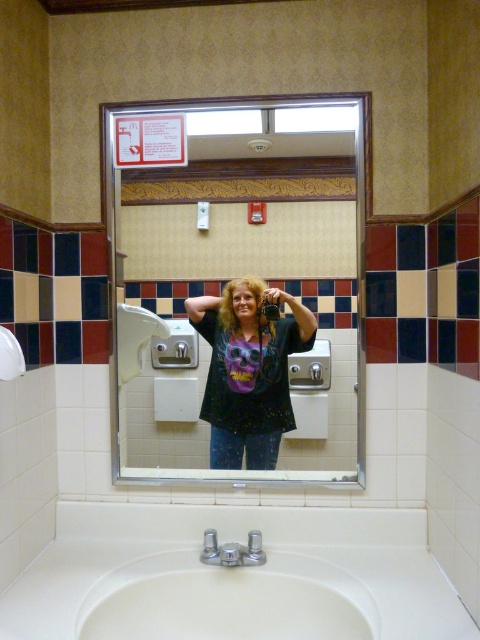
Question: Is white glossy sink at lower center to the left of matte black t-shirt at center from the viewer's perspective?

Choices:
 (A) yes
 (B) no

Answer: (A)

Question: Does clear glass mirror at upper center have a greater width compared to white glossy sink at lower center?

Choices:
 (A) no
 (B) yes

Answer: (B)

Question: Considering the real-world distances, which object is farthest from the clear glass mirror at upper center?

Choices:
 (A) white glossy sink at lower center
 (B) matte black t-shirt at center

Answer: (A)

Question: Considering the relative positions of white glossy sink at lower center and matte black t-shirt at center in the image provided, where is white glossy sink at lower center located with respect to matte black t-shirt at center?

Choices:
 (A) left
 (B) right

Answer: (A)

Question: Which object is farther from the camera taking this photo?

Choices:
 (A) clear glass mirror at upper center
 (B) white glossy sink at lower center

Answer: (A)

Question: Considering the real-world distances, which object is closest to the matte black t-shirt at center?

Choices:
 (A) clear glass mirror at upper center
 (B) white glossy sink at lower center

Answer: (A)